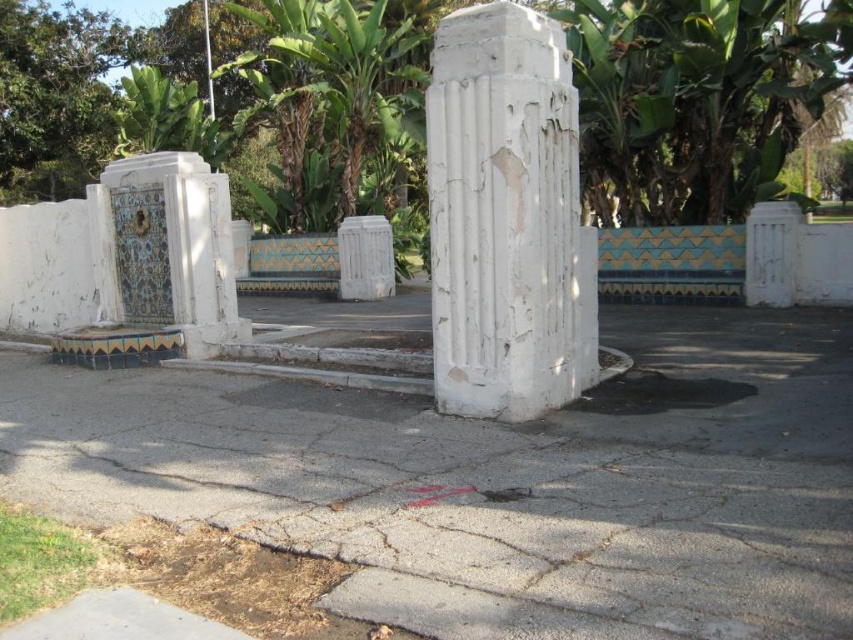
You are a gardener with a 6 feet long hose. You need to water the plants near the gray asphalt pavement at center and the white cracked concrete column at center. Can your hose reach from one to the other without moving it?

The distance between the gray asphalt pavement at center and the white cracked concrete column at center is 5.68 feet. Since the hose is 6 feet long, it can easily span the distance, so yes, the hose can reach from one to the other without moving it.

You are standing at the base of the white, weathered column in the park. You want to walk to the gray asphalt pavement at center. Which direction should you head relative to the column?

The gray asphalt pavement at center is located at point (500, 481), which is to the right of the white, weathered column. Therefore, you should head to the right to reach it.